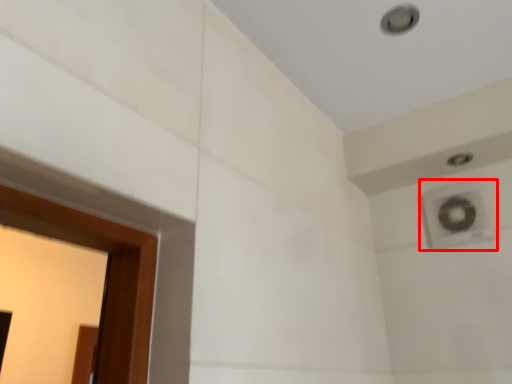
Question: In this image, where is air conditioning (annotated by the red box) located relative to hole?

Choices:
 (A) left
 (B) right

Answer: (B)